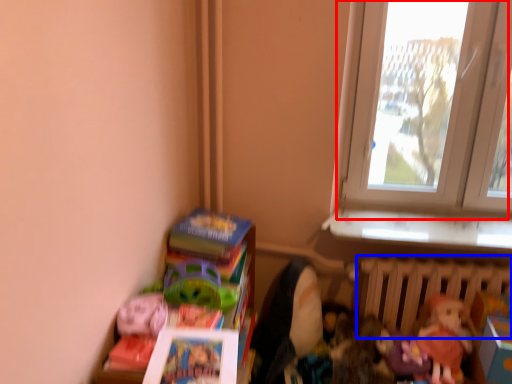
Question: Which object appears farthest to the camera in this image, window (highlighted by a red box) or radiator (highlighted by a blue box)?

Choices:
 (A) window
 (B) radiator

Answer: (B)